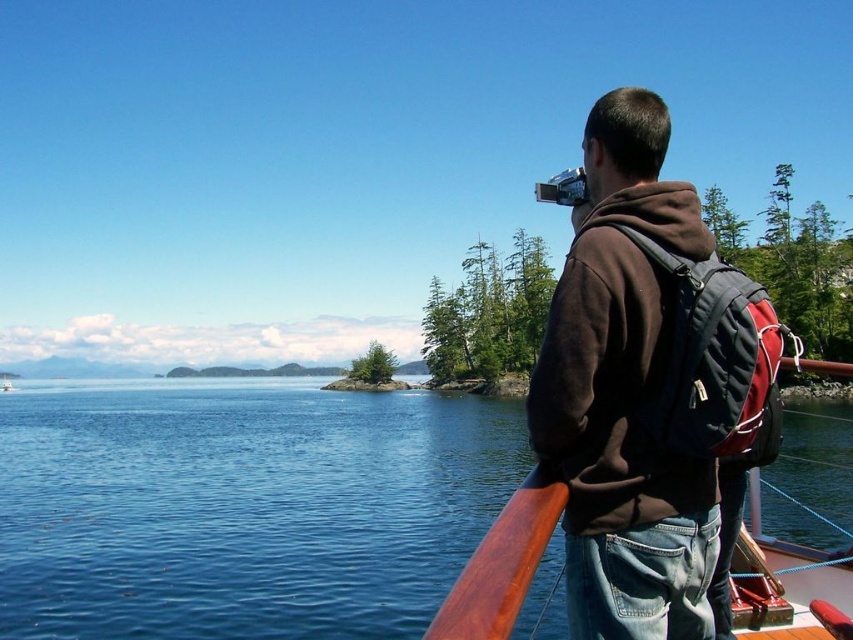
Question: In this image, where is blue water at center located relative to brown matte hoodie at upper right?

Choices:
 (A) right
 (B) left

Answer: (B)

Question: Can you confirm if blue water at center is positioned above brown matte hoodie at upper right?

Choices:
 (A) no
 (B) yes

Answer: (A)

Question: Which of the following is the closest to the observer?

Choices:
 (A) blue water at center
 (B) brown matte hoodie at upper right

Answer: (A)

Question: Which point appears closest to the camera in this image?

Choices:
 (A) (26, 429)
 (B) (569, 456)

Answer: (B)

Question: Where is blue water at center located in relation to brown matte hoodie at upper right in the image?

Choices:
 (A) below
 (B) above

Answer: (A)